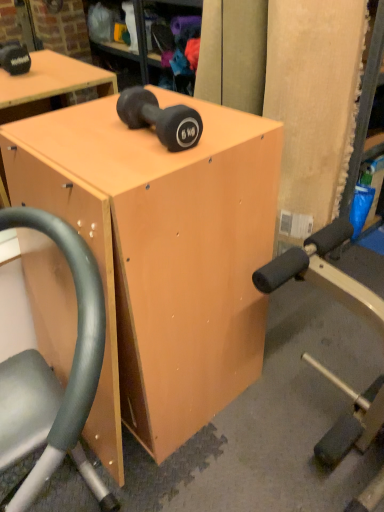
Question: Is matte wood table at center inside the boundaries of matte black dumbbell at center, or outside?

Choices:
 (A) inside
 (B) outside

Answer: (B)

Question: Is point (69, 289) closer or farther from the camera than point (147, 110)?

Choices:
 (A) farther
 (B) closer

Answer: (A)

Question: Relative to matte black dumbbell at center, is matte wood table at center in front or behind?

Choices:
 (A) behind
 (B) front

Answer: (B)

Question: Is matte black dumbbell at center spatially inside matte wood table at center, or outside of it?

Choices:
 (A) outside
 (B) inside

Answer: (A)

Question: Relative to matte wood table at center, is matte black dumbbell at center in front or behind?

Choices:
 (A) behind
 (B) front

Answer: (A)

Question: Does point (135, 112) appear closer or farther from the camera than point (205, 378)?

Choices:
 (A) closer
 (B) farther

Answer: (A)

Question: Visually, is matte black dumbbell at center positioned to the left or to the right of matte wood table at center?

Choices:
 (A) left
 (B) right

Answer: (B)